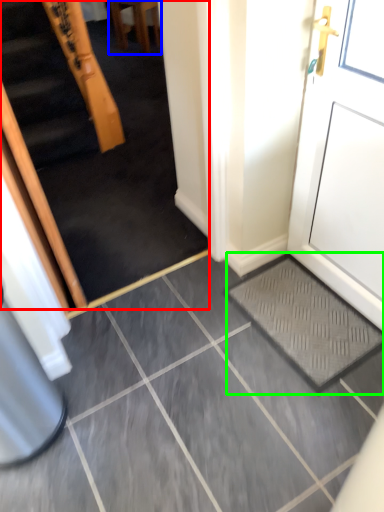
Question: Which is nearer to the escalator (highlighted by a red box)? furniture (highlighted by a blue box) or doormat (highlighted by a green box).

Choices:
 (A) furniture
 (B) doormat

Answer: (B)